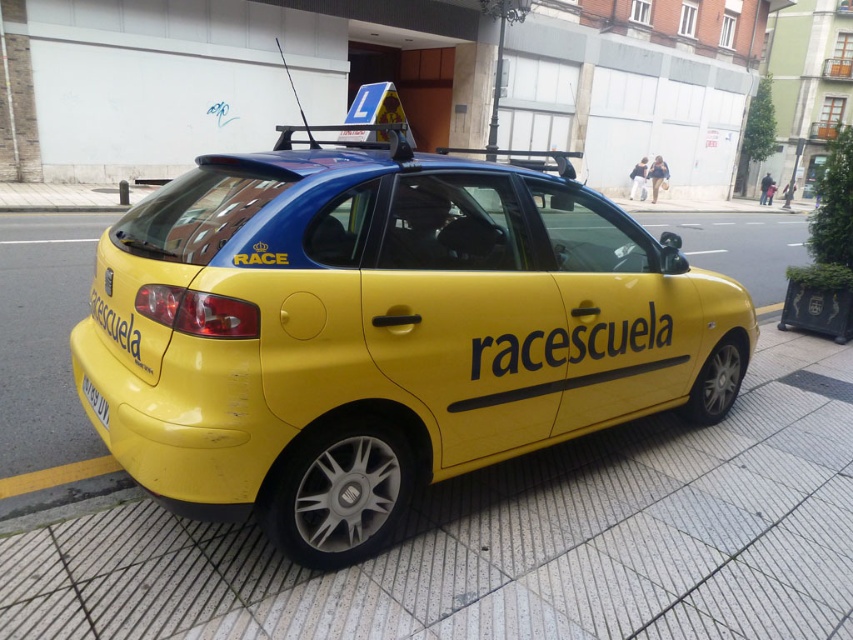
You are a delivery person trying to locate the yellow matte car at center for a package delivery. According to the map, the car is at point 0.516, 0.447. Can you confirm if the car is indeed at that location?

Yes, the yellow matte car at center is positioned at point (380,330) as stated in the map.

You are a pedestrian standing on the sidewalk next to the yellow car parked there. You see the yellow matte text at center and the yellow plastic license plate at lower left. Which one is higher up?

The yellow matte text at center is above the yellow plastic license plate at lower left, so the yellow matte text at center is higher up.